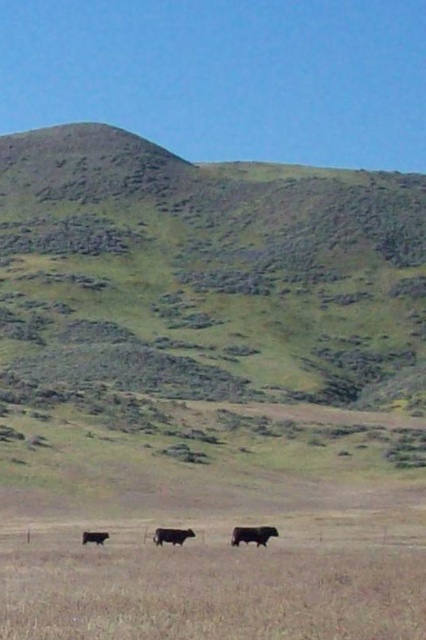
You are a farmer who needs to identify the cow that is taller. Looking at the black matte cow at center and the shiny brown cow at lower left, which one should you choose?

The black matte cow at center is taller than the shiny brown cow at lower left.

You are a farmer standing at the edge of the dry grassland looking towards the shiny black cow at center. If you walk straight ahead, will you reach the cow before the slope of the hill starts?

The shiny black cow at center is located at point [253,534]. Since the cow is positioned closer to the middle ground where the slope begins, you would reach the slope before the cow.

You are a farmer who wants to identify the cow that takes up more space in the image. Which cow between the shiny black cow at center and the black matte cow at center should you choose?

The black matte cow at center occupies more space than the shiny black cow at center, so you should choose the black matte cow at center.